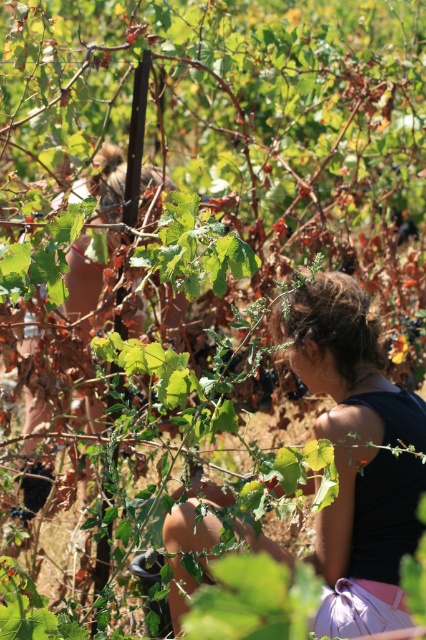
Which is below, dark brown hair at center or matte brown hair at center?

dark brown hair at center is below.

In the scene shown: Does dark brown hair at center appear on the right side of matte brown hair at center?

Yes, dark brown hair at center is to the right of matte brown hair at center.

At what (x,y) coordinates should I click in order to perform the action: click on dark brown hair at center. Please return your answer as a coordinate pair (x, y). This screenshot has width=426, height=640. Looking at the image, I should click on (356, 456).

The width and height of the screenshot is (426, 640). I want to click on dark brown hair at center, so click(x=356, y=456).